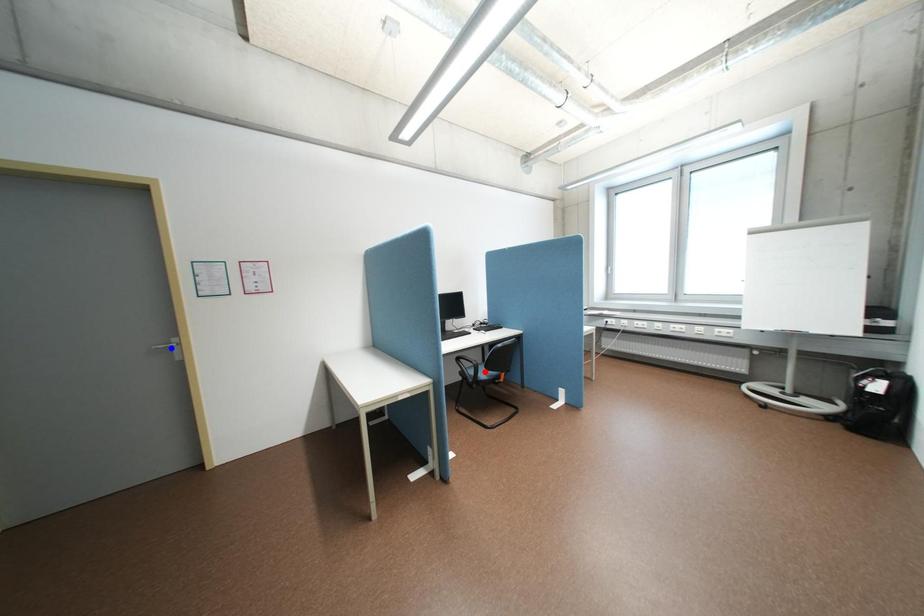
Question: Two points are marked on the image. Which point is closer to the camera?

Choices:
 (A) Blue point is closer.
 (B) Red point is closer.

Answer: (A)